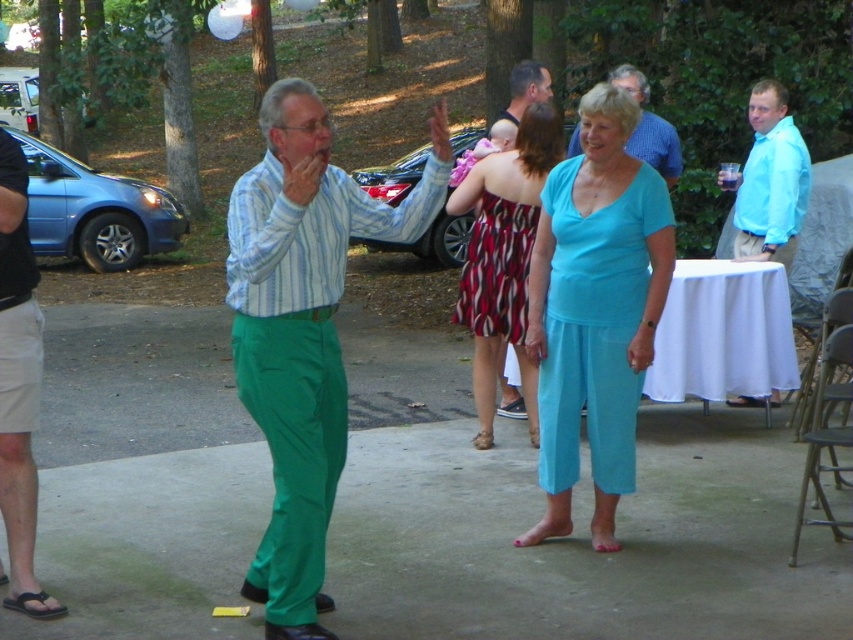
You are at an outdoor gathering and want to find the matte blue shirt at center. Where should you look relative to the brown leather sandal at lower left?

The matte blue shirt at center is located above the brown leather sandal at lower left, so you should look upwards from the brown leather sandal at lower left to find it.

You are organizing a costume party and need to decide which outfit takes up more space. Based on the image, which one is wider between the matte green pants at center and the red and black striped dress at center?

The matte green pants at center is wider than the red and black striped dress at center according to the description.